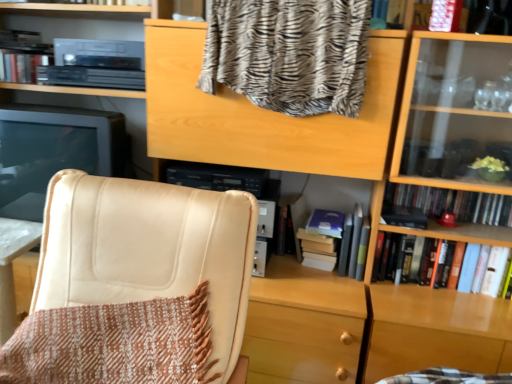
Question: From a real-world perspective, is hardcover book at right, which is the first book from bottom to top, on beige leather chair at left?

Choices:
 (A) yes
 (B) no

Answer: (A)

Question: Is hardcover book at right, acting as the second book starting from the right, with beige leather chair at left?

Choices:
 (A) yes
 (B) no

Answer: (B)

Question: Is hardcover book at right, acting as the second book starting from the right, closer to camera compared to beige leather chair at left?

Choices:
 (A) yes
 (B) no

Answer: (B)

Question: From the image's perspective, is hardcover book at right, which appears as the 4th book when viewed from the top, located above beige leather chair at left?

Choices:
 (A) no
 (B) yes

Answer: (B)

Question: Is hardcover book at right, which appears as the 4th book when viewed from the top, turned away from beige leather chair at left?

Choices:
 (A) yes
 (B) no

Answer: (B)

Question: Considering the relative sizes of hardcover book at right, the 3th book viewed from the left, and gray matte book at center, arranged as the second book when viewed from the left, in the image provided, is hardcover book at right, the 3th book viewed from the left, taller than gray matte book at center, arranged as the second book when viewed from the left,?

Choices:
 (A) no
 (B) yes

Answer: (A)

Question: Is hardcover book at right, the 3th book viewed from the left, further to camera compared to gray matte book at center, the third book when ordered from top to bottom?

Choices:
 (A) no
 (B) yes

Answer: (A)

Question: Is hardcover book at right, which is the first book from bottom to top, completely or partially outside of gray matte book at center, the 3th book in the right-to-left sequence?

Choices:
 (A) no
 (B) yes

Answer: (B)

Question: From the image's perspective, is hardcover book at right, the 3th book viewed from the left, on gray matte book at center, which is the second book in bottom-to-top order?

Choices:
 (A) no
 (B) yes

Answer: (A)

Question: Considering the relative sizes of hardcover book at right, which is the first book from bottom to top, and gray matte book at center, arranged as the second book when viewed from the left, in the image provided, is hardcover book at right, which is the first book from bottom to top, wider than gray matte book at center, arranged as the second book when viewed from the left,?

Choices:
 (A) no
 (B) yes

Answer: (A)

Question: From a real-world perspective, is hardcover book at right, acting as the second book starting from the right, on top of gray matte book at center, the 3th book in the right-to-left sequence?

Choices:
 (A) yes
 (B) no

Answer: (B)

Question: Is gray matte book at center, which is the second book in bottom-to-top order, to the left of brown woven blanket at lower left, which appears as the 1th blanket when ordered from the bottom, from the viewer's perspective?

Choices:
 (A) no
 (B) yes

Answer: (A)